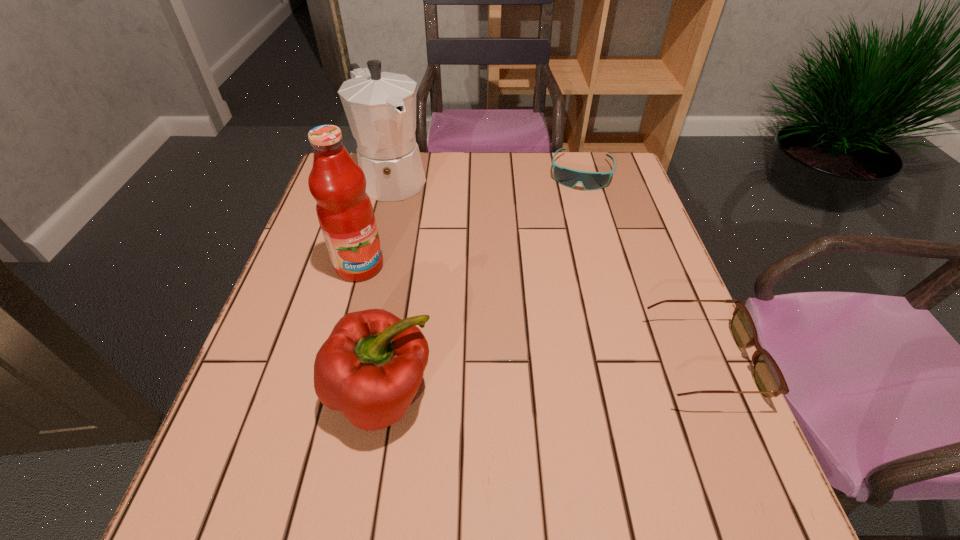
This screenshot has width=960, height=540. What are the coordinates of `vacant space on the desktop that is between the third tallest object and the spectacles and is positioned on the front label of the third nearest object` in the screenshot? It's located at (513, 381).

Image resolution: width=960 pixels, height=540 pixels. I want to click on vacant space on the desktop that is between the third shortest object and the spectacles and is positioned on the front-facing side of the shortest object, so click(x=540, y=379).

Locate an element on the screen. free space on the desktop that is between the third tallest object and the spectacles and is positioned at the spout of the coffeepot is located at coordinates (577, 375).